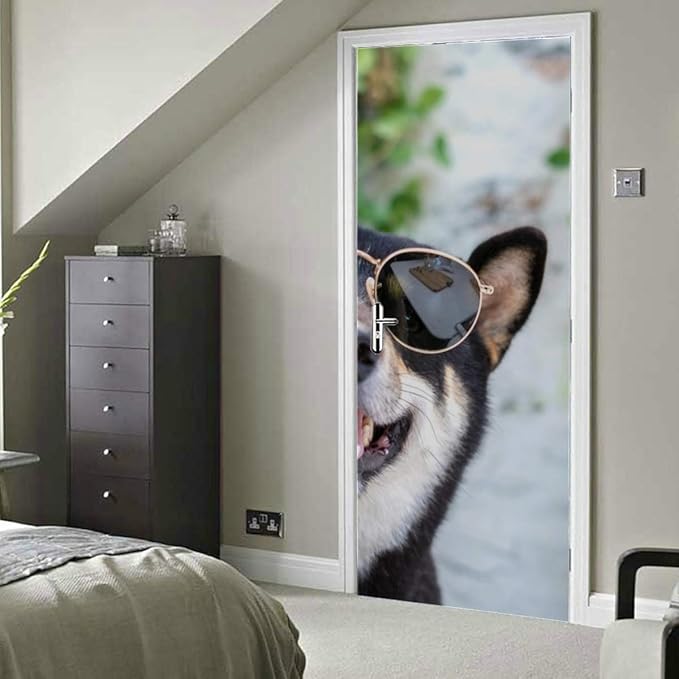
Locate an element on the screen. crystal bottle on top of dresser is located at coordinates (172, 244).